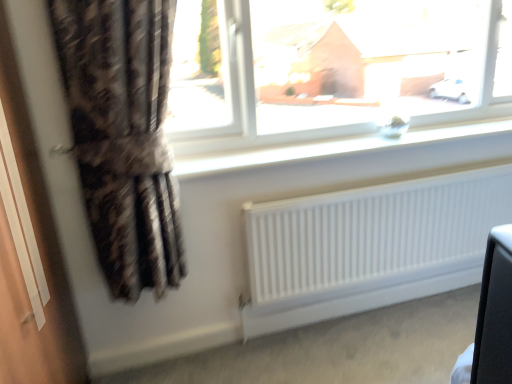
Identify the location of free region under plaid fabric curtain at left (from a real-world perspective). (189, 368).